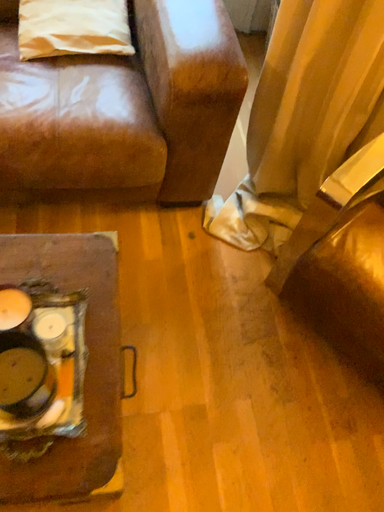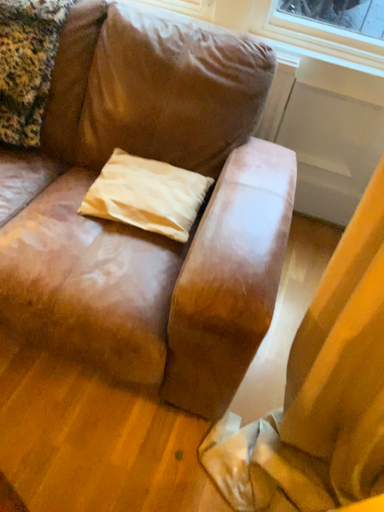
Question: How did the camera likely rotate when shooting the video?

Choices:
 (A) rotated right
 (B) rotated left

Answer: (B)